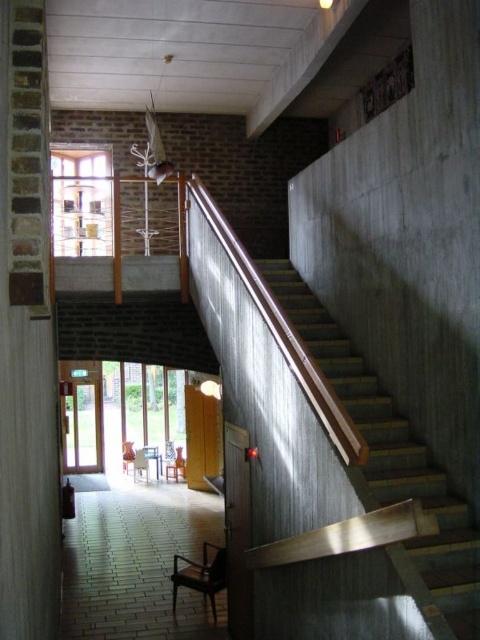
Does brick at left appear over wooden stairs at right?

Yes, brick at left is above wooden stairs at right.

Who is shorter, brick at left or wooden stairs at right?

wooden stairs at right

Identify the location of brick at left. This screenshot has height=640, width=480. (25, 337).

I want to click on brick at left, so click(25, 337).